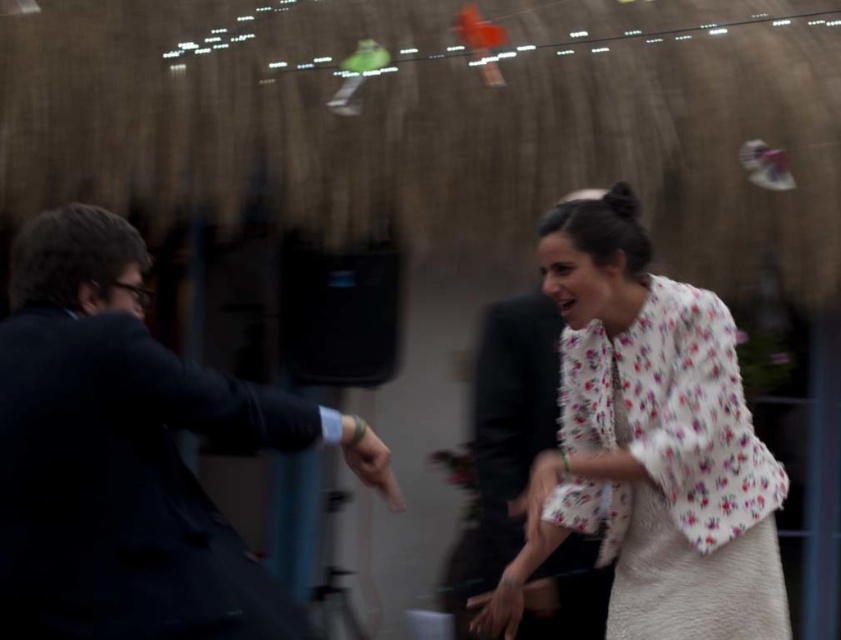
In the scene shown: In the scene, there are two points labeled as point (710, 353) and point (357, 470). From the observer perspective, which point is closer to the front of the image?

Point (357, 470) is closer to the front because it is in front of point (710, 353).

You are a photographer at the event and want to capture a closeup shot of the floral fabric blouse at center and the matte black hand at center. Which object should you zoom in on more to ensure both are in focus?

Since the floral fabric blouse at center is bigger than the matte black hand at center, you should zoom in more on the floral fabric blouse at center to ensure both objects are in focus.

You are at a party and see the dark blue suit at left and the matte black hand at center. Which object is positioned further to the left?

The dark blue suit at left is positioned further to the left than the matte black hand at center.